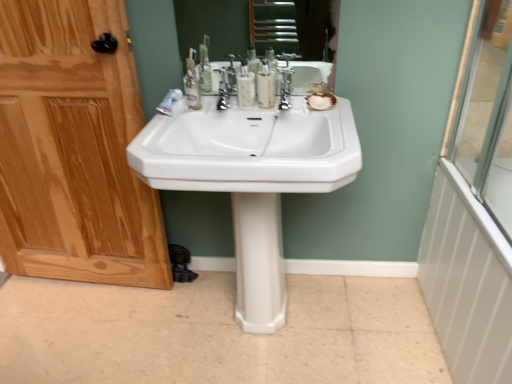
Locate an element on the screen. vacant space to the right of wooden door at left is located at coordinates (178, 318).